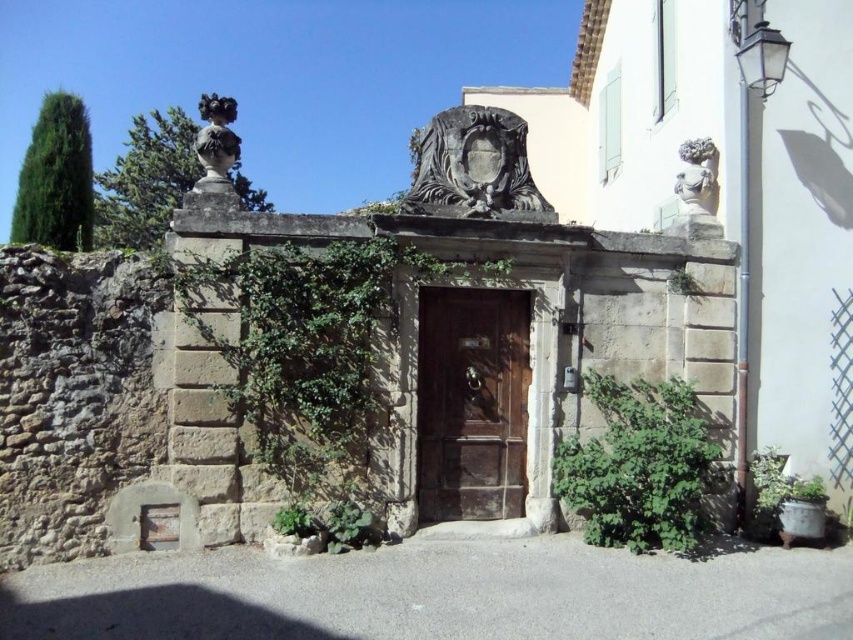
Does carved stone crest at upper center have a lesser height compared to white stone bust at upper right?

In fact, carved stone crest at upper center may be taller than white stone bust at upper right.

Between point (430, 195) and point (692, 196), which one is positioned in front?

Positioned in front is point (430, 195).

Who is more distant from viewer, (434,157) or (686,236)?

Positioned behind is point (686,236).

This screenshot has width=853, height=640. In order to click on carved stone crest at upper center in this screenshot , I will do `click(474, 164)`.

Find the location of `wooden door at center`. wooden door at center is located at coordinates (471, 403).

Which is behind, point (498, 340) or point (76, 240)?

The point (76, 240) is behind.

Where is `wooden door at center`? This screenshot has width=853, height=640. wooden door at center is located at coordinates (471, 403).

Is point (601, 374) more distant than point (706, 150)?

No, (601, 374) is in front of (706, 150).

Does green leafy ivy at lower right appear on the right side of white stone bust at upper right?

Incorrect, green leafy ivy at lower right is not on the right side of white stone bust at upper right.

Is point (666, 484) farther from camera compared to point (698, 205)?

That is False.

This screenshot has height=640, width=853. In order to click on green leafy ivy at lower right in this screenshot , I will do `click(641, 467)`.